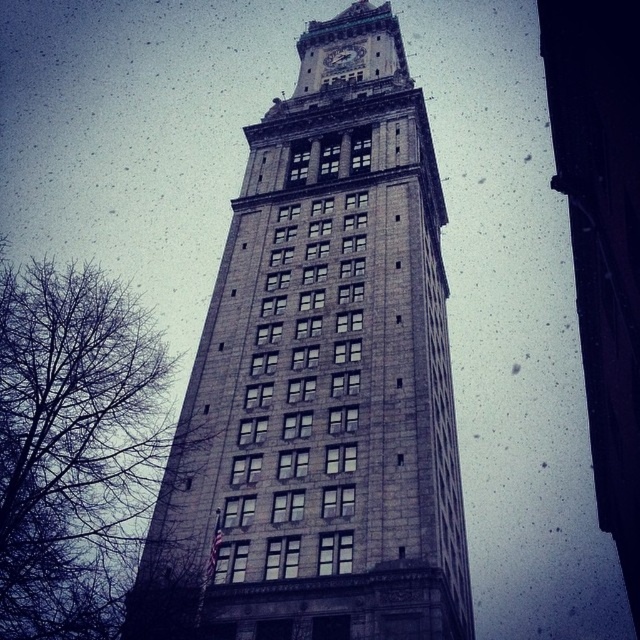
Question: Is the position of gray stone clock tower at center less distant than that of white marble clock at upper center?

Choices:
 (A) no
 (B) yes

Answer: (B)

Question: Which point is farther to the camera?

Choices:
 (A) (433, 627)
 (B) (333, 61)

Answer: (B)

Question: Is gray stone clock tower at center bigger than white marble clock at upper center?

Choices:
 (A) no
 (B) yes

Answer: (B)

Question: In this image, where is gray stone clock tower at center located relative to white marble clock at upper center?

Choices:
 (A) left
 (B) right

Answer: (A)